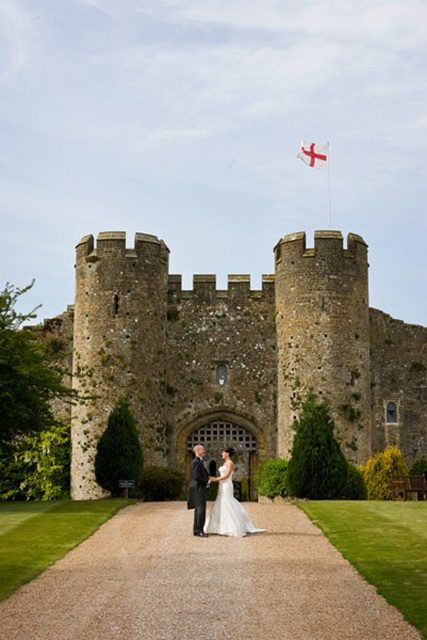
You are a photographer trying to capture the couple standing on the gravel path leading to the castle. The white satin dress at center is represented by point [228,504]. Where should you position yourself to ensure the dress is centered in your shot?

To center the white satin dress at point [228,504], position yourself directly facing the dress along the gravel path, aligning the camera so the dress occupies the center of the frame.

You are a photographer planning to take a portrait of the white satin dress at center and the stone textured castle at center. Since both are at the center, how are they arranged vertically?

The stone textured castle at center is located above the white satin dress at center, so in the portrait, the castle will appear higher up in the frame while the dress will be positioned lower.

You are standing at the starting point of the gravel path leading to the stone textured castle at center. If you walk straight ahead, will you reach the castle?

Yes, because the stone textured castle at center is located directly along the path you are on, so walking straight ahead will lead you to it.